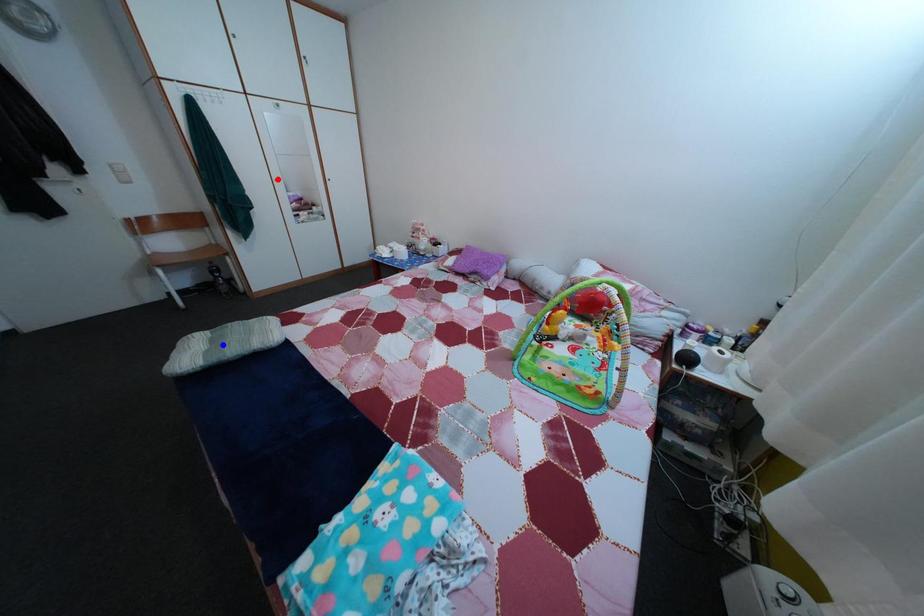
Question: Two points are marked on the image. Which point is closer to the camera?

Choices:
 (A) Blue point is closer.
 (B) Red point is closer.

Answer: (A)